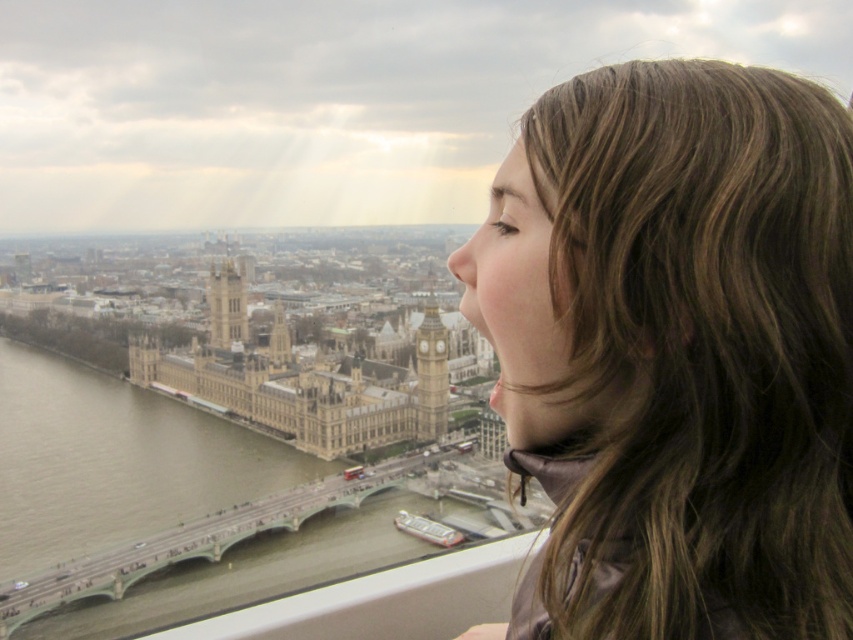
You are standing at the point marked by the coordinates point (178, 547) in the image. What landmark are you closest to?

The point (178, 547) corresponds to the concrete bridge at lower left, so you are closest to the concrete bridge at lower left.

You are a tourist standing in London and see the golden stone clock tower at center and the golden stone tower at center. Which one is located lower in the image?

The golden stone clock tower at center is positioned under the golden stone tower at center, so it is located lower in the image.

Based on the scene description, which of the two golden stone structures at the center of the image is taller? Please refer to the golden stone clock tower at center and the golden stone tower at center in your answer.

The golden stone clock tower at center is taller than the golden stone tower at center according to the description provided.